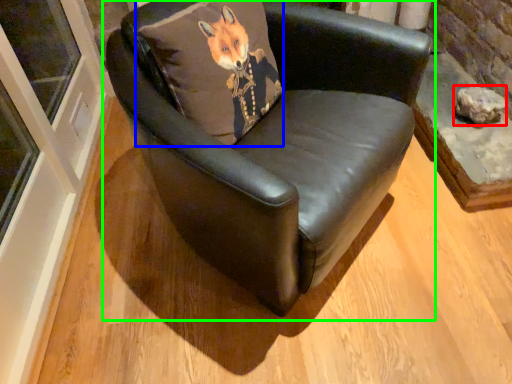
Question: Which object is positioned farthest from stone (highlighted by a red box)? Select from pillow (highlighted by a blue box) and chair (highlighted by a green box).

Choices:
 (A) pillow
 (B) chair

Answer: (A)